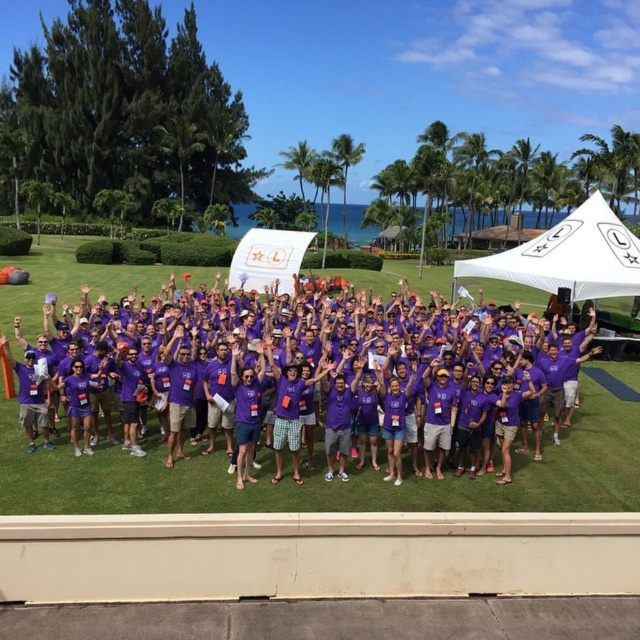
Question: Which point is closer to the camera taking this photo?

Choices:
 (A) (330, 419)
 (B) (627, 269)

Answer: (A)

Question: Is purple cotton shirt at center to the left of white fabric canopy at center from the viewer's perspective?

Choices:
 (A) yes
 (B) no

Answer: (A)

Question: Does purple cotton shirt at center appear under white fabric canopy at center?

Choices:
 (A) yes
 (B) no

Answer: (A)

Question: Among these points, which one is farthest from the camera?

Choices:
 (A) (141, 356)
 (B) (508, 264)

Answer: (B)

Question: From the image, what is the correct spatial relationship of purple cotton shirt at center in relation to white fabric canopy at center?

Choices:
 (A) above
 (B) below

Answer: (B)